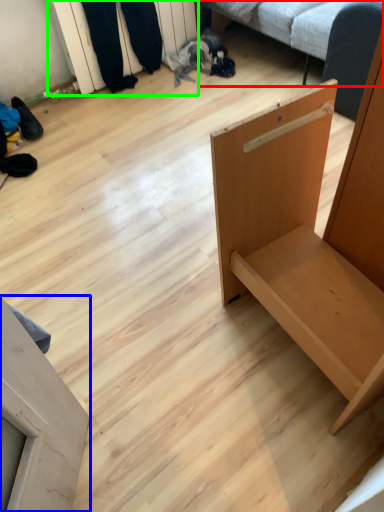
Question: Which object is the closest to the studio couch (highlighted by a red box)? Choose among these: furniture (highlighted by a blue box) or shelf (highlighted by a green box).

Choices:
 (A) furniture
 (B) shelf

Answer: (B)